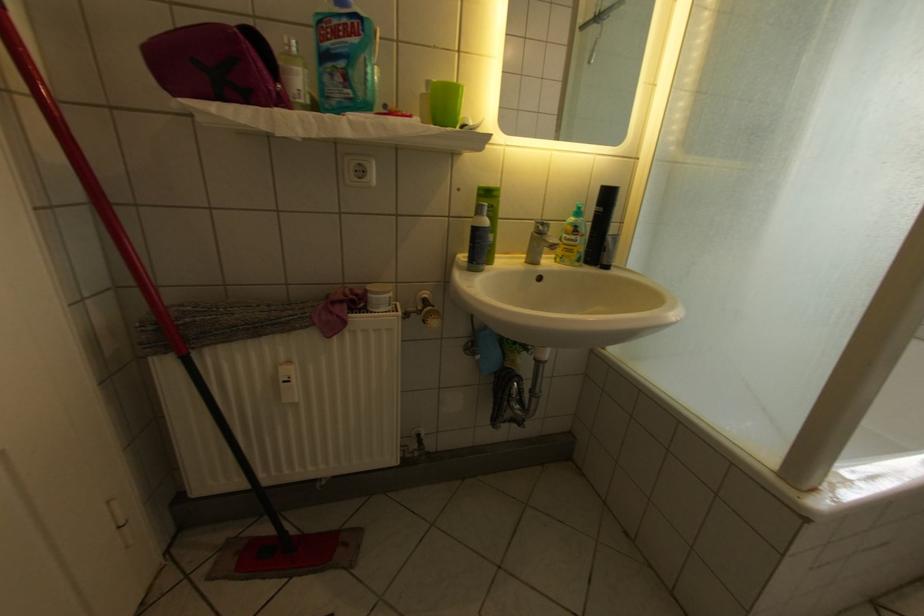
The width and height of the screenshot is (924, 616). Find the location of `green plastic cup`. green plastic cup is located at coordinates (444, 103).